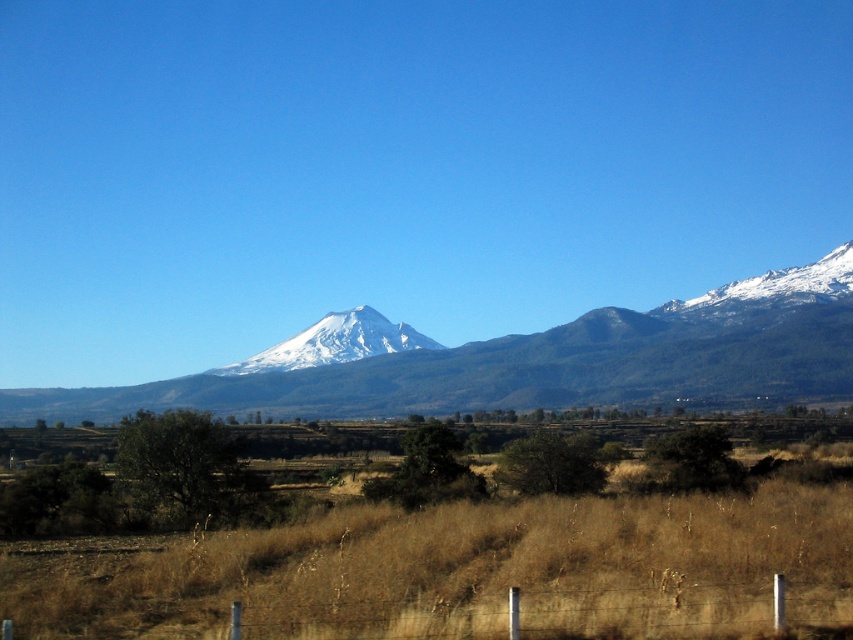
Question: Considering the real-world distances, which object is farthest from the snowy rocky mountain at upper right?

Choices:
 (A) snowy rock mountain at center
 (B) brown dry grass at lower center
 (C) white snow-covered mountain at center

Answer: (B)

Question: Is snowy rock mountain at center to the left of snowy rocky mountain at upper right from the viewer's perspective?

Choices:
 (A) no
 (B) yes

Answer: (B)

Question: Among these points, which one is farthest from the camera?

Choices:
 (A) (277, 349)
 (B) (671, 632)
 (C) (676, 358)

Answer: (A)

Question: Which point is farther to the camera?

Choices:
 (A) snowy rock mountain at center
 (B) snowy rocky mountain at upper right

Answer: (B)

Question: Is snowy rock mountain at center thinner than white snow-covered mountain at center?

Choices:
 (A) no
 (B) yes

Answer: (A)

Question: Can you confirm if white snow-covered mountain at center is smaller than snowy rocky mountain at upper right?

Choices:
 (A) no
 (B) yes

Answer: (B)